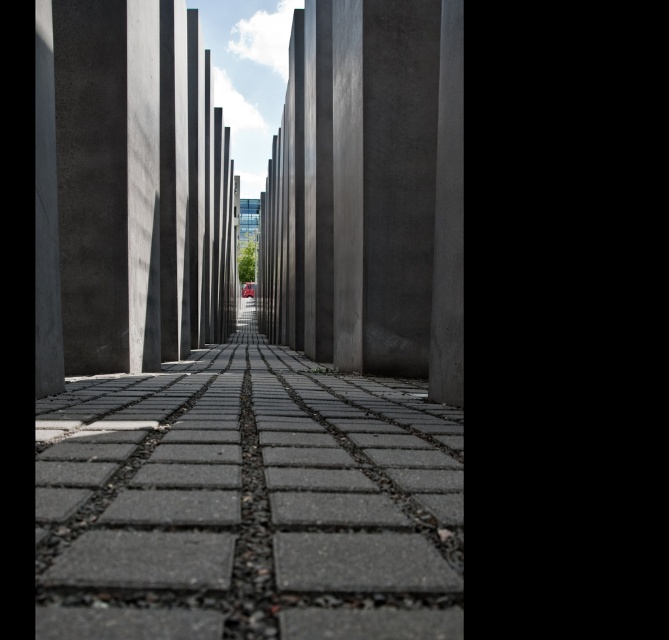
Question: Which object is the closest to the gray concrete pavement at center?

Choices:
 (A) smooth concrete pillar at center
 (B) sleek concrete pillar at center

Answer: (B)

Question: Considering the relative positions of sleek concrete pillar at center and smooth concrete pillar at center in the image provided, where is sleek concrete pillar at center located with respect to smooth concrete pillar at center?

Choices:
 (A) above
 (B) below

Answer: (B)

Question: Is gray concrete pavement at center to the right of smooth concrete pillar at center from the viewer's perspective?

Choices:
 (A) yes
 (B) no

Answer: (A)

Question: Is gray concrete pavement at center further to camera compared to smooth concrete pillar at center?

Choices:
 (A) yes
 (B) no

Answer: (B)

Question: Which point is farther from the camera taking this photo?

Choices:
 (A) (258, 348)
 (B) (76, 230)

Answer: (A)

Question: Among these points, which one is farthest from the camera?

Choices:
 (A) (328, 392)
 (B) (391, 340)
 (C) (82, 29)

Answer: (B)